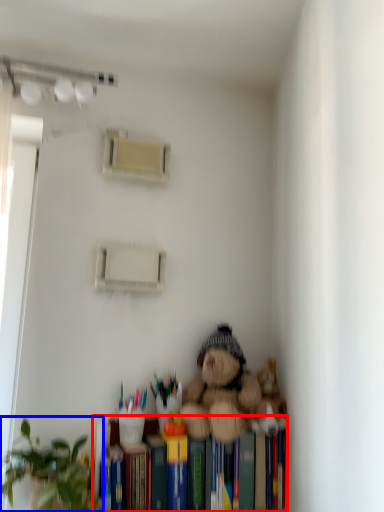
Question: Which of the following is the closest to the observer, bookshelf (highlighted by a red box) or houseplant (highlighted by a blue box)?

Choices:
 (A) bookshelf
 (B) houseplant

Answer: (B)